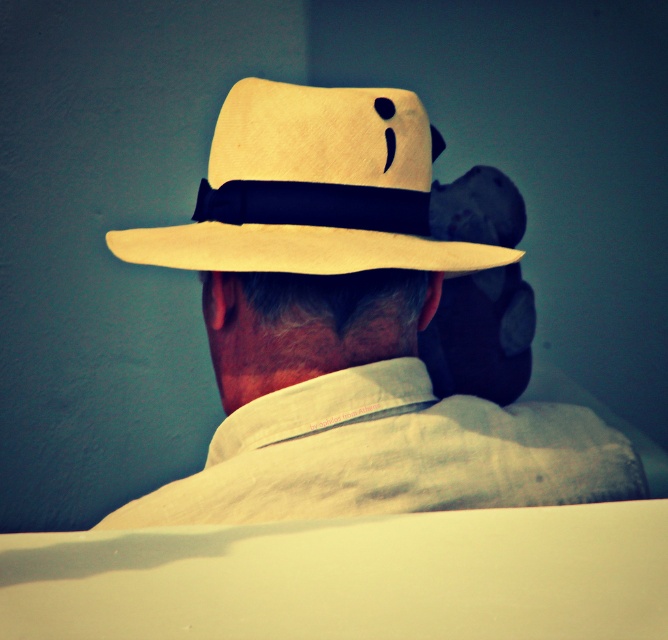
Question: Which point appears farthest from the camera in this image?

Choices:
 (A) (418, 262)
 (B) (261, 296)

Answer: (B)

Question: Is matte straw hat at center behind suede beige fedora at center?

Choices:
 (A) yes
 (B) no

Answer: (B)

Question: Does matte straw hat at center lie in front of suede beige fedora at center?

Choices:
 (A) yes
 (B) no

Answer: (A)

Question: Considering the relative positions of matte straw hat at center and suede beige fedora at center in the image provided, where is matte straw hat at center located with respect to suede beige fedora at center?

Choices:
 (A) right
 (B) left

Answer: (A)